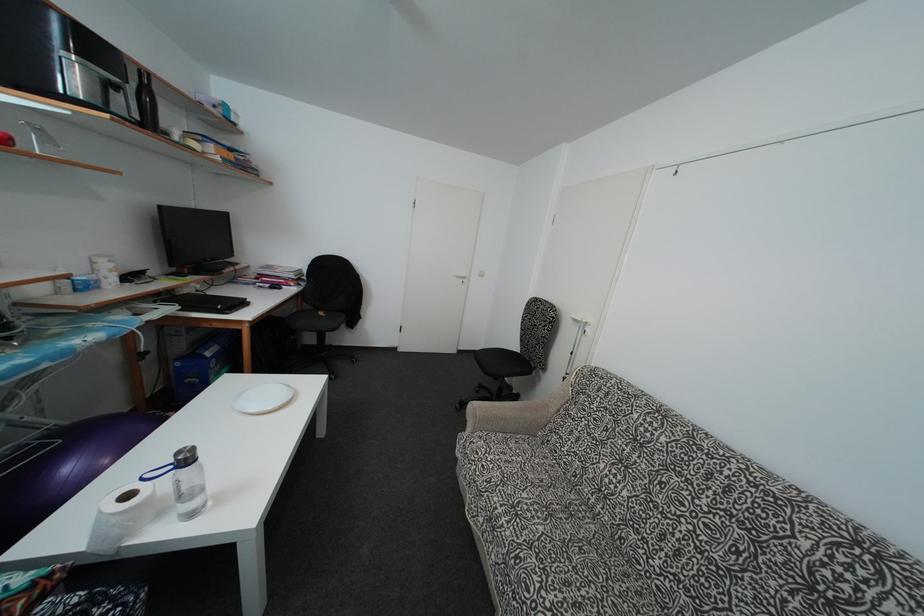
Locate an element on the screen. The image size is (924, 616). blue bottle strap is located at coordinates (163, 480).